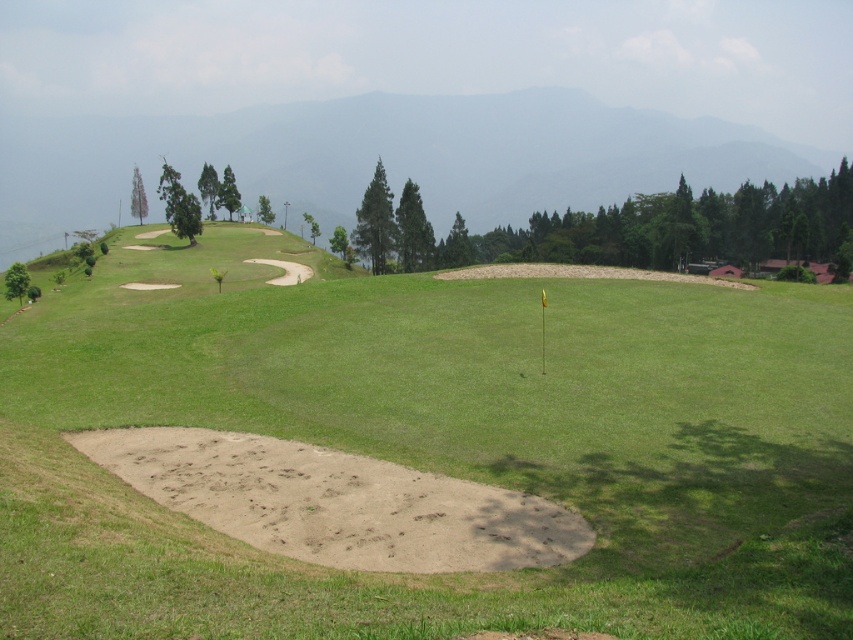
Question: Can you confirm if smooth sand trap at center is wider than green grassy hillside at upper center?

Choices:
 (A) yes
 (B) no

Answer: (B)

Question: In this image, where is smooth sand trap at center located relative to green grassy hillside at upper center?

Choices:
 (A) right
 (B) left

Answer: (B)

Question: Which object is farther from the camera taking this photo?

Choices:
 (A) smooth sand trap at center
 (B) green grassy hillside at upper center

Answer: (B)

Question: Is smooth sand trap at center below green grassy hillside at upper center?

Choices:
 (A) no
 (B) yes

Answer: (B)

Question: Which object is closer to the camera taking this photo?

Choices:
 (A) green grassy hillside at upper center
 (B) smooth sand trap at center

Answer: (B)